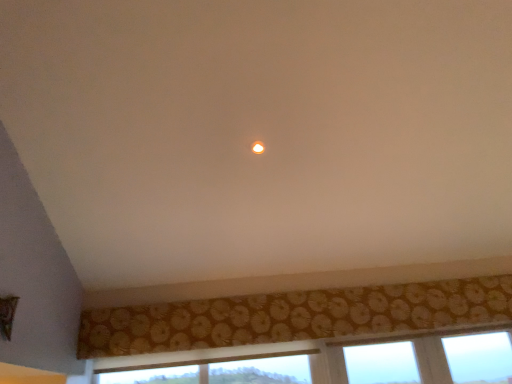
Question: Looking at their shapes, would you say gold textured curtain at lower center is wider or thinner than matte yellow light at center?

Choices:
 (A) wide
 (B) thin

Answer: (B)

Question: Relative to matte yellow light at center, is gold textured curtain at lower center in front or behind?

Choices:
 (A) behind
 (B) front

Answer: (A)

Question: Is gold textured curtain at lower center taller or shorter than matte yellow light at center?

Choices:
 (A) tall
 (B) short

Answer: (A)

Question: Is matte yellow light at center wider or thinner than gold textured curtain at lower center?

Choices:
 (A) thin
 (B) wide

Answer: (B)

Question: Considering the relative positions of matte yellow light at center and gold textured curtain at lower center in the image provided, is matte yellow light at center to the left or to the right of gold textured curtain at lower center?

Choices:
 (A) left
 (B) right

Answer: (A)

Question: Would you say matte yellow light at center is inside or outside gold textured curtain at lower center?

Choices:
 (A) outside
 (B) inside

Answer: (A)

Question: Is matte yellow light at center taller or shorter than gold textured curtain at lower center?

Choices:
 (A) tall
 (B) short

Answer: (B)